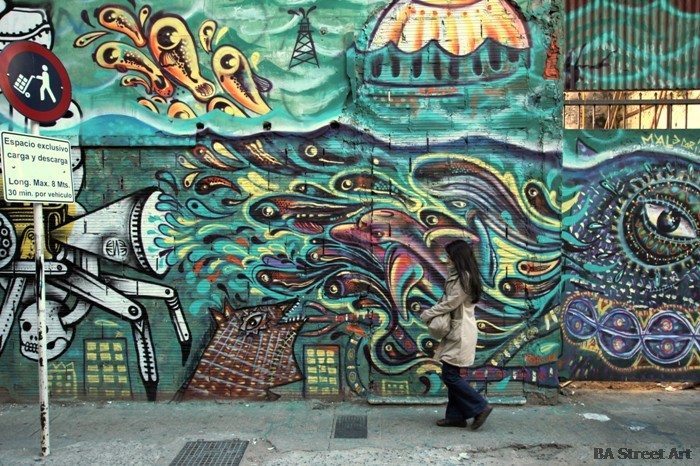
The image size is (700, 466). In order to click on blue painting in this screenshot , I will do `click(309, 109)`.